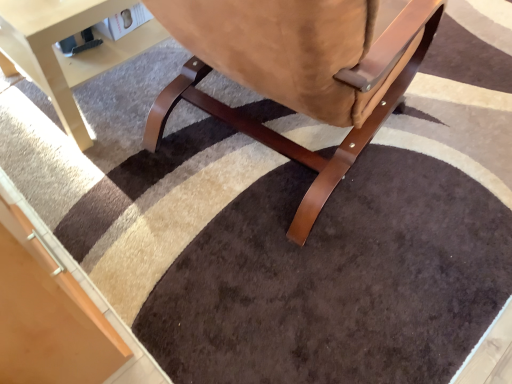
Find the location of `light beige wood table at lower left`. light beige wood table at lower left is located at coordinates (63, 54).

What do you see at coordinates (63, 54) in the screenshot? I see `light beige wood table at lower left` at bounding box center [63, 54].

What do you see at coordinates (336, 80) in the screenshot? This screenshot has width=512, height=384. I see `suede-like brown chair at center` at bounding box center [336, 80].

This screenshot has width=512, height=384. Find the location of `suede-like brown chair at center`. suede-like brown chair at center is located at coordinates (336, 80).

Identify the location of light beige wood table at lower left. The image size is (512, 384). (63, 54).

Based on their positions, is light beige wood table at lower left located to the left or right of suede-like brown chair at center?

From the image, it's evident that light beige wood table at lower left is to the left of suede-like brown chair at center.

Considering the relative positions of light beige wood table at lower left and suede-like brown chair at center in the image provided, is light beige wood table at lower left in front of suede-like brown chair at center?

No, light beige wood table at lower left is further to the viewer.

Between point (135, 55) and point (269, 135), which one is positioned in front?

The point (269, 135) is closer.

Based on the photo, from the image's perspective, does light beige wood table at lower left appear lower than suede-like brown chair at center?

No, from the image's perspective, light beige wood table at lower left is not below suede-like brown chair at center.

From a real-world perspective, does light beige wood table at lower left sit lower than suede-like brown chair at center?

Yes.

Which of these two, light beige wood table at lower left or suede-like brown chair at center, is thinner?

With smaller width is light beige wood table at lower left.

Looking at this image, is light beige wood table at lower left taller than suede-like brown chair at center?

No, light beige wood table at lower left is not taller than suede-like brown chair at center.

Does light beige wood table at lower left have a larger size compared to suede-like brown chair at center?

Actually, light beige wood table at lower left might be smaller than suede-like brown chair at center.

In the scene shown: Choose the correct answer: Is light beige wood table at lower left inside suede-like brown chair at center or outside it?

The correct answer is: outside.

Is light beige wood table at lower left not near suede-like brown chair at center?

No, light beige wood table at lower left is not far away from suede-like brown chair at center.

Is light beige wood table at lower left oriented away from suede-like brown chair at center?

No, suede-like brown chair at center is not at the back of light beige wood table at lower left.

Can you tell me how much light beige wood table at lower left and suede-like brown chair at center differ in facing direction?

There is a 9.83-degree angle between the facing directions of light beige wood table at lower left and suede-like brown chair at center.

Measure the distance from light beige wood table at lower left to suede-like brown chair at center.

17.26 inches.

The image size is (512, 384). I want to click on table lying behind the suede-like brown chair at center, so click(63, 54).

Which is more to the left, suede-like brown chair at center or light beige wood table at lower left?

light beige wood table at lower left is more to the left.

Is suede-like brown chair at center positioned behind light beige wood table at lower left?

No.

Is point (294, 229) positioned behind point (15, 18)?

Yes.

From the image's perspective, is suede-like brown chair at center above light beige wood table at lower left?

No, from the image's perspective, suede-like brown chair at center is not over light beige wood table at lower left.

From a real-world perspective, is suede-like brown chair at center physically located above or below light beige wood table at lower left?

Clearly, from a real-world perspective, suede-like brown chair at center is above light beige wood table at lower left.

Is suede-like brown chair at center thinner than light beige wood table at lower left?

Incorrect, the width of suede-like brown chair at center is not less than that of light beige wood table at lower left.

Based on the photo, does suede-like brown chair at center have a greater height compared to light beige wood table at lower left?

Yes, suede-like brown chair at center is taller than light beige wood table at lower left.

Considering the relative sizes of suede-like brown chair at center and light beige wood table at lower left in the image provided, is suede-like brown chair at center bigger than light beige wood table at lower left?

Correct, suede-like brown chair at center is larger in size than light beige wood table at lower left.

Is suede-like brown chair at center inside or outside of light beige wood table at lower left?

suede-like brown chair at center is spatially situated outside light beige wood table at lower left.

Is suede-like brown chair at center not close to light beige wood table at lower left?

No.

Could you tell me if suede-like brown chair at center is facing light beige wood table at lower left?

No, suede-like brown chair at center is not turned towards light beige wood table at lower left.

What's the angular difference between suede-like brown chair at center and light beige wood table at lower left's facing directions?

There is a 9.83-degree angle between the facing directions of suede-like brown chair at center and light beige wood table at lower left.

The height and width of the screenshot is (384, 512). I want to click on chair positioned vertically above the light beige wood table at lower left (from a real-world perspective), so click(336, 80).

The image size is (512, 384). I want to click on table above the suede-like brown chair at center (from the image's perspective), so click(63, 54).

Where is `chair on the right of light beige wood table at lower left`? chair on the right of light beige wood table at lower left is located at coordinates (336, 80).